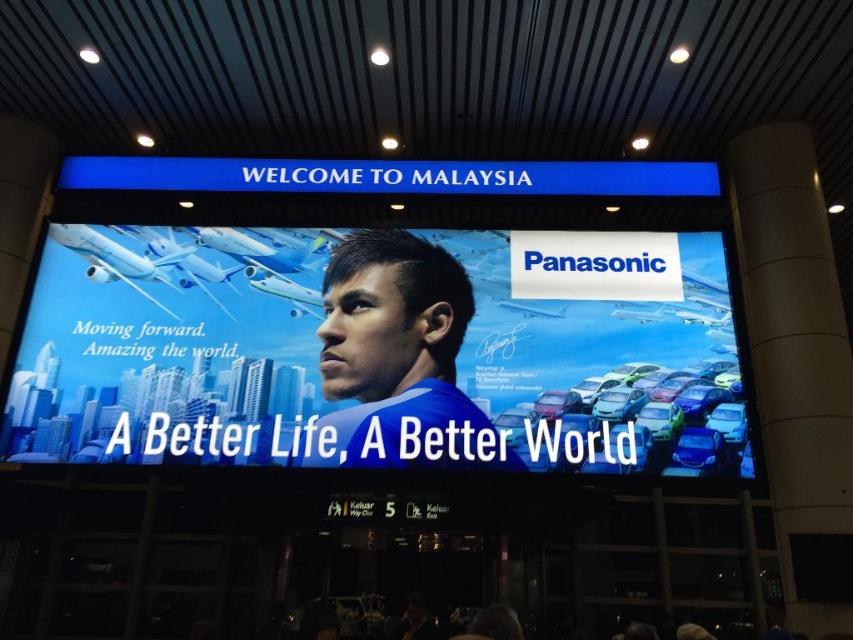
You are standing at the airport terminal and looking at the Panasonic advertisement on the digital billboard. There are two points marked on the billboard. Which point is closer to you, point (363,348) or point (215,172)?

Point (363,348) is closer to the viewer than point (215,172).

You are standing in the airport terminal and notice two blue signs. The first is the blue glossy billboard at center, and the second is the blue metallic signboard at upper center. Which of these two signs is narrower in width?

The blue glossy billboard at center is thinner than the blue metallic signboard at upper center, so the blue glossy billboard at center is narrower in width.

In the scene shown: You are standing in the airport terminal and see the blue glossy billboard at center and the blue fabric at center. Which object is positioned to the left?

The blue glossy billboard at center is positioned to the left of the blue fabric at center.